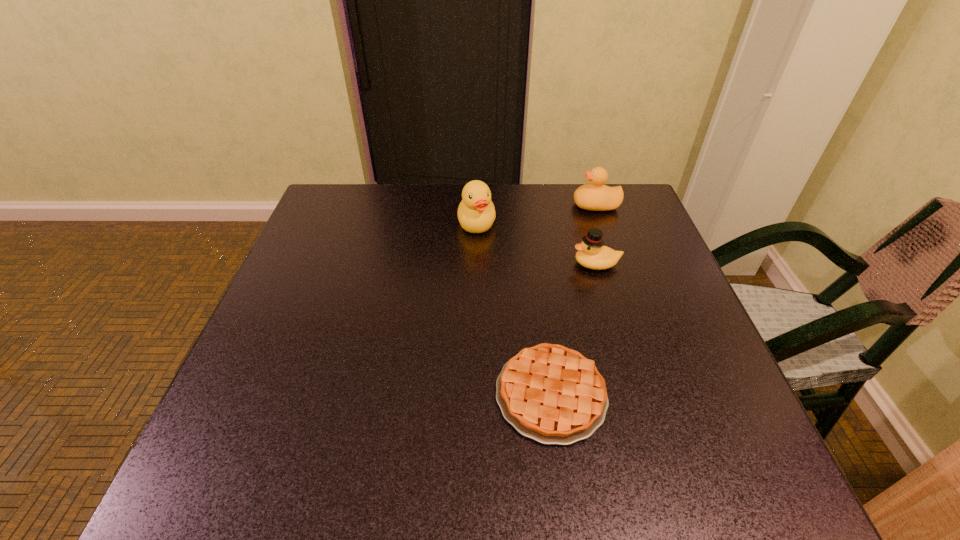
The height and width of the screenshot is (540, 960). I want to click on object that is positioned at the near edge, so click(x=552, y=394).

Locate an element on the screen. The image size is (960, 540). object located in the far right corner section of the desktop is located at coordinates coord(595,196).

I want to click on vacant space at the far edge, so click(500, 192).

Find the location of a particular element. The image size is (960, 540). blank area at the near edge is located at coordinates (631, 446).

This screenshot has height=540, width=960. I want to click on vacant space at the left edge, so click(320, 272).

The width and height of the screenshot is (960, 540). In order to click on vacant space at the right edge of the desktop in this screenshot , I will do `click(625, 320)`.

The image size is (960, 540). Find the location of `free space at the far left corner of the desktop`. free space at the far left corner of the desktop is located at coordinates (363, 197).

In the image, there is a desktop. Identify the location of vacant space at the near left corner. The height and width of the screenshot is (540, 960). 269,460.

Where is `vacant space at the near right corner of the desktop`? The height and width of the screenshot is (540, 960). vacant space at the near right corner of the desktop is located at coordinates (728, 486).

Identify the location of free space between the leftmost duck and the pie. (514, 309).